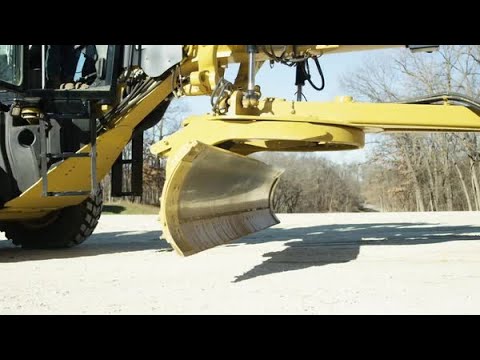
Locate an element on the screen. frame is located at coordinates (112, 152).